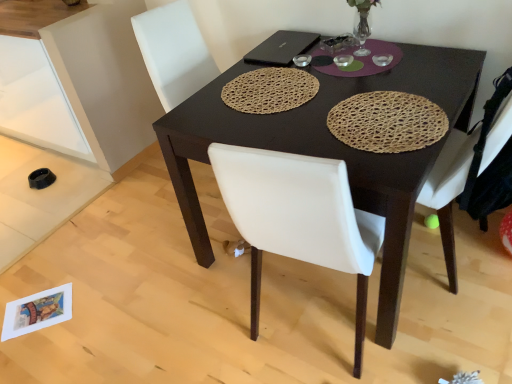
You are a GUI agent. You are given a task and a screenshot of the screen. Output one action in this format:
    pyautogui.click(x=<x>, y=<y>)
    Task: Click on the vacant space situated on the left part of woven straw placemat at center, the 2th mat when ordered from left to right
    
    Given the screenshot: What is the action you would take?
    pyautogui.click(x=283, y=121)